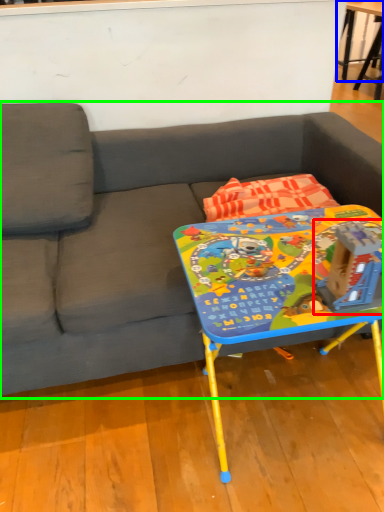
Question: Which is nearer to the toy (highlighted by a red box)? table (highlighted by a blue box) or studio couch (highlighted by a green box).

Choices:
 (A) table
 (B) studio couch

Answer: (B)